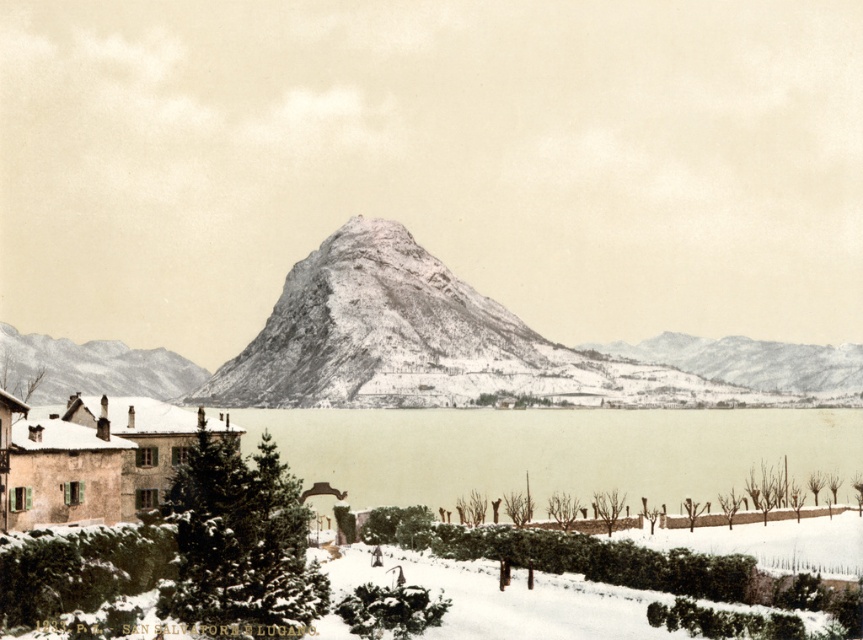
Question: Is gray textured mountain at center in front of snowy rocky mountain at left?

Choices:
 (A) no
 (B) yes

Answer: (B)

Question: Which point is closer to the camera?

Choices:
 (A) gray textured mountain at center
 (B) snowy rocky mountain at left

Answer: (A)

Question: Is gray textured mountain at center further to camera compared to snowy rocky mountain at left?

Choices:
 (A) no
 (B) yes

Answer: (A)

Question: Does gray textured mountain at center have a greater width compared to snowy rocky mountain at left?

Choices:
 (A) yes
 (B) no

Answer: (B)